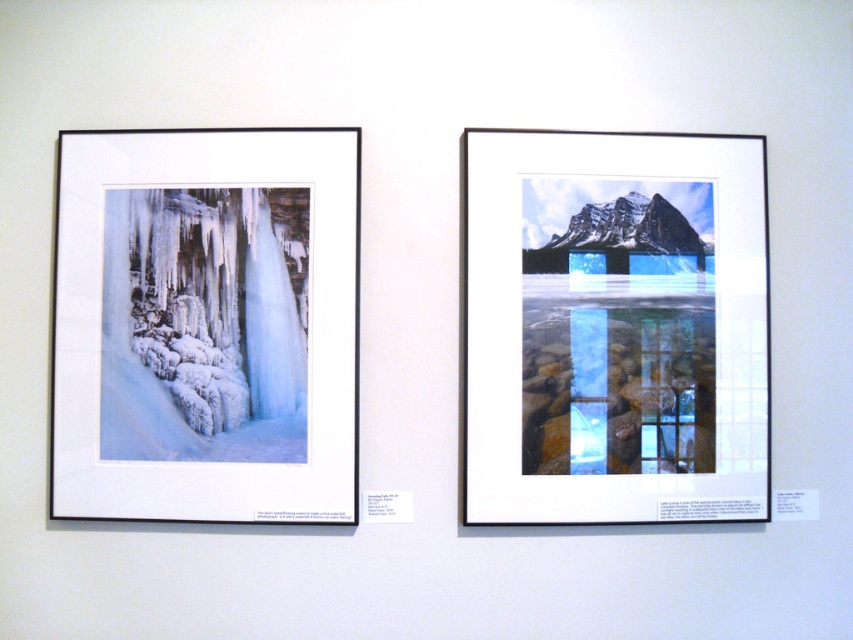
You are hanging a new picture frame on the wall between the two existing photographs. The frame has a hook that needs to be placed exactly at the center point of the wall. The coordinates of the center point are given as point A. Where should you place the hook relative to the white matte paper at upper right?

The hook should be placed at point A, which is the center of the wall. Since the white matte paper at upper right is located at point (x=613, y=326), you can determine its position relative to point A by calculating the distance between them. However, without knowing the exact dimensions of the wall or the coordinates of point A, it is impossible to provide a precise answer.

You are an interior designer arranging two white matte papers on a wall. The scene shows a wall with two framed photographs. You need to ensure that the white matte paper at upper right and white matte paper at left are placed correctly. Based on the scene description, which white matte paper has a larger height?

The white matte paper at upper right has a greater height compared to the white matte paper at left, so the one at upper right is larger in height.

You are an interior designer arranging decor items on a white wall. You have two white matte papers to place. The white matte paper at upper right and the white matte paper at left. Which one should you choose if you want to place a larger decorative item on the wall?

The white matte paper at upper right has a larger size compared to the white matte paper at left, so you should choose the white matte paper at upper right to place a larger decorative item on the wall.